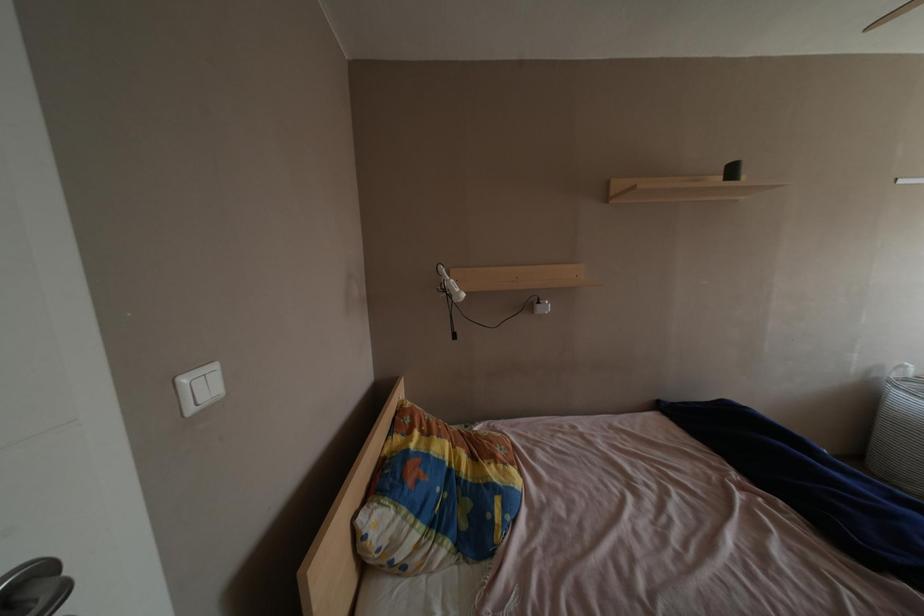
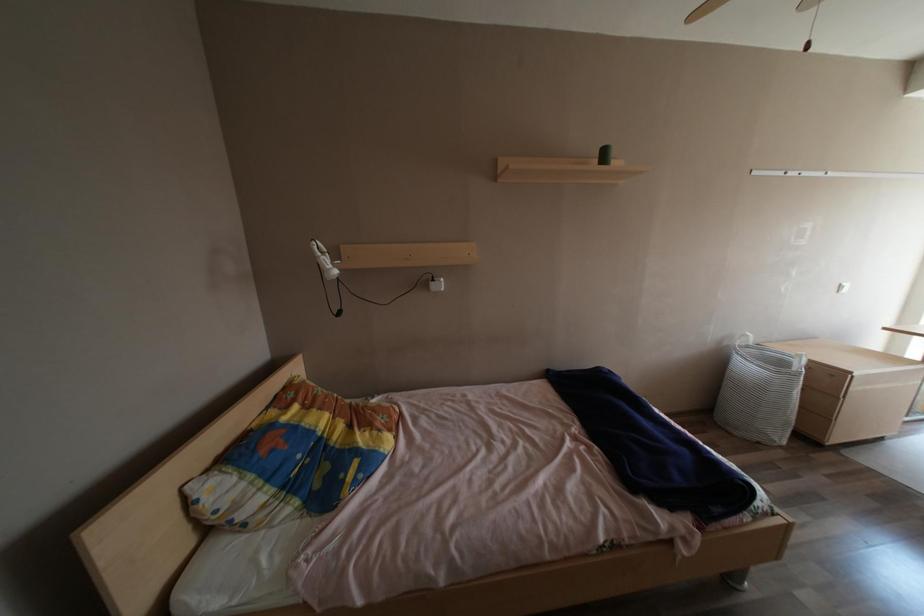
Question: The images are taken continuously from a first-person perspective. In which direction is your viewpoint rotating?

Choices:
 (A) Left
 (B) Right
 (C) Up
 (D) Down

Answer: (B)